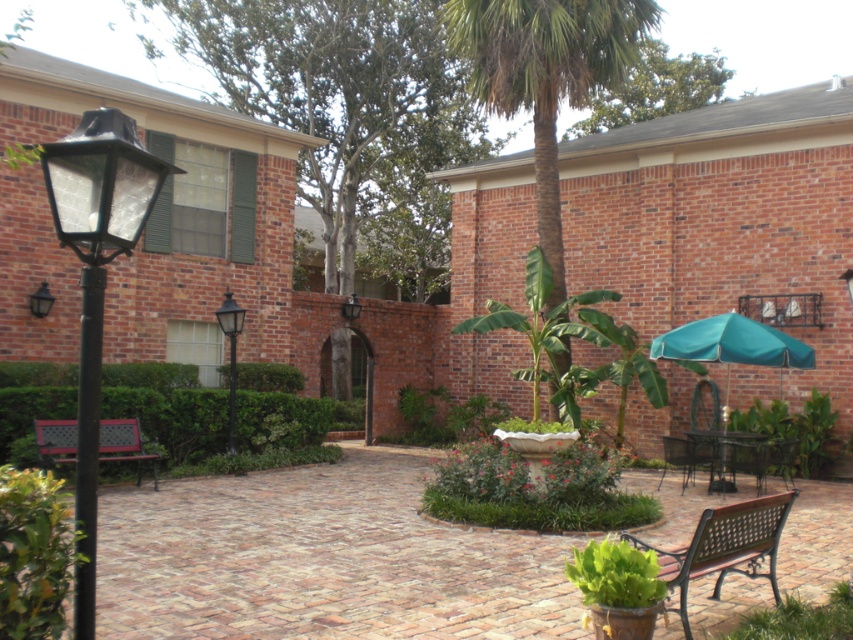
Consider the image. You are a visitor in the courtyard and want to sit on the wooden bench at lower left. Can you sit there without standing under the matte black lamp at upper center?

The wooden bench at lower left is positioned under the matte black lamp at upper center, so sitting there would place you under the lamp.

You are standing in the courtyard and want to sit on the wooden bench at lower left. Which direction should you move from the white stone birdbath at center to reach it?

You should move to the left from the white stone birdbath at center to reach the wooden bench at lower left because the wooden bench at lower left is to the left of the white stone birdbath at center.

You are a maintenance worker who needs to clean the white stone birdbath at center and the wooden bench at lower left. Which object requires you to use a ladder to reach its top surface?

The wooden bench at lower left requires a ladder because it is taller than the white stone birdbath at center.